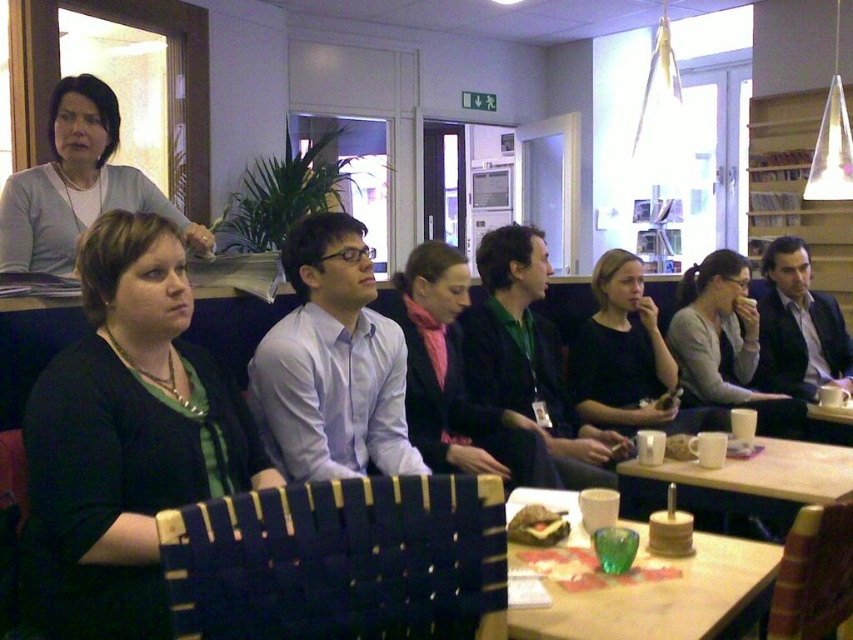
You are a barista preparing to place a matte gray sweater at center on the table where there are white ceramic cups at lower right. Considering the size of the sweater and the cups, will the sweater fit on the table without overlapping the cups?

The white ceramic cups at lower right are wider than the matte gray sweater at center. Since the cups are wider, there should be enough space to place the sweater on the table without overlapping the cups.

You are a food delivery person who needs to place a small container on the table without covering any items already there. The dark green sweater at center and the matte brown sandwich at center are on the table. Which item can you place the container next to without overlapping?

The matte brown sandwich at center is shorter than the dark green sweater at center, so placing the container next to the matte brown sandwich at center would leave more space and avoid overlapping.